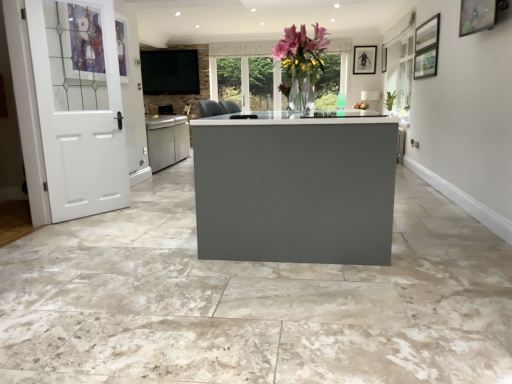
The height and width of the screenshot is (384, 512). What do you see at coordinates (170, 72) in the screenshot?
I see `matte black tv at upper center` at bounding box center [170, 72].

Identify the location of white painted wood door at left. (78, 106).

Is matte black tv at upper center aimed at wooden picture frame at upper right, arranged as the 2th picture frame when viewed from the right?

No, matte black tv at upper center is not facing towards wooden picture frame at upper right, arranged as the 2th picture frame when viewed from the right.

Which is less distant, (169, 57) or (459, 26)?

The point (459, 26) is closer to the camera.

Is matte black tv at upper center surrounding wooden picture frame at upper right, the first picture frame from the front?

That's incorrect, wooden picture frame at upper right, the first picture frame from the front, is not inside matte black tv at upper center.

Looking at the image, does matte black tv at upper center seem bigger or smaller compared to wooden picture frame at upper right, acting as the 2th picture frame starting from the top?

Considering their sizes, matte black tv at upper center takes up more space than wooden picture frame at upper right, acting as the 2th picture frame starting from the top.

Between point (91, 1) and point (486, 19), which one is positioned in front?

The point (486, 19) is closer.

Could you tell me if white painted wood door at left is facing wooden picture frame at upper right, acting as the 2th picture frame starting from the top?

No, white painted wood door at left is not aimed at wooden picture frame at upper right, acting as the 2th picture frame starting from the top.

How much distance is there between white painted wood door at left and wooden picture frame at upper right, which is the first picture frame from bottom to top?

white painted wood door at left and wooden picture frame at upper right, which is the first picture frame from bottom to top, are 3.41 meters apart from each other.

Is white painted wood door at left not within matte black picture frame at upper right, which is counted as the second picture frame, starting from the front?

Yes, white painted wood door at left is not within matte black picture frame at upper right, which is counted as the second picture frame, starting from the front.

Is white painted wood door at left positioned with its back to matte black picture frame at upper right, placed as the 1th picture frame when sorted from back to front?

No, white painted wood door at left is not facing the opposite direction of matte black picture frame at upper right, placed as the 1th picture frame when sorted from back to front.

Is white painted wood door at left taller than matte black picture frame at upper right, arranged as the first picture frame when viewed from the top?

Yes, white painted wood door at left is taller than matte black picture frame at upper right, arranged as the first picture frame when viewed from the top.

Is white painted wood door at left placed right next to matte black picture frame at upper right, which is the second picture frame in bottom-to-top order?

No, white painted wood door at left is not beside matte black picture frame at upper right, which is the second picture frame in bottom-to-top order.

Is wooden picture frame at upper right, acting as the 2th picture frame starting from the top, facing towards white painted wood door at left?

Yes.

How distant is wooden picture frame at upper right, arranged as the 2th picture frame when viewed from the right, from white painted wood door at left?

They are 3.41 meters apart.

Does wooden picture frame at upper right, the first picture frame from the front, appear on the right side of white painted wood door at left?

Yes, wooden picture frame at upper right, the first picture frame from the front, is to the right of white painted wood door at left.

From the white painted wood door at left, count 1st picture frame to the right and point to it. Please provide its 2D coordinates.

[(477, 16)]

Does wooden picture frame at upper right, which is the first picture frame from bottom to top, have a smaller size compared to matte black tv at upper center?

Indeed, wooden picture frame at upper right, which is the first picture frame from bottom to top, has a smaller size compared to matte black tv at upper center.

Is wooden picture frame at upper right, placed as the 2th picture frame when sorted from back to front, closer to the viewer compared to matte black tv at upper center?

That is True.

In the scene shown: Is matte black tv at upper center at the back of wooden picture frame at upper right, which appears as the first picture frame when viewed from the left?

That's not correct — wooden picture frame at upper right, which appears as the first picture frame when viewed from the left, is not looking away from matte black tv at upper center.

Is point (483, 25) closer to camera compared to point (170, 58)?

Yes.

Are matte black picture frame at upper right, which is the second picture frame in bottom-to-top order, and wooden picture frame at upper right, the first picture frame from the front, located far from each other?

Yes, matte black picture frame at upper right, which is the second picture frame in bottom-to-top order, is far from wooden picture frame at upper right, the first picture frame from the front.

What's the angular difference between matte black picture frame at upper right, arranged as the first picture frame when viewed from the top, and wooden picture frame at upper right, acting as the 2th picture frame starting from the top,'s facing directions?

91.6 degrees separate the facing orientations of matte black picture frame at upper right, arranged as the first picture frame when viewed from the top, and wooden picture frame at upper right, acting as the 2th picture frame starting from the top.

From the image's perspective, is matte black picture frame at upper right, which is the second picture frame in bottom-to-top order, located above or below wooden picture frame at upper right, arranged as the 2th picture frame when viewed from the right?

Based on their image positions, matte black picture frame at upper right, which is the second picture frame in bottom-to-top order, is located above wooden picture frame at upper right, arranged as the 2th picture frame when viewed from the right.

Which is correct: matte black picture frame at upper right, the second picture frame in the left-to-right sequence, is inside wooden picture frame at upper right, arranged as the 2th picture frame when viewed from the right, or outside of it?

matte black picture frame at upper right, the second picture frame in the left-to-right sequence, is not enclosed by wooden picture frame at upper right, arranged as the 2th picture frame when viewed from the right.

Is matte black tv at upper center far from white painted wood door at left?

Yes.

Find the location of a particular element. The image size is (512, 384). door below the matte black tv at upper center (from a real-world perspective) is located at coordinates (78, 106).

Is matte black tv at upper center in front of or behind white painted wood door at left in the image?

Clearly, matte black tv at upper center is behind white painted wood door at left.

Is matte black tv at upper center wider than white painted wood door at left?

Yes.

At what (x,y) coordinates should I click in order to perform the action: click on window screen on the left side of wooden picture frame at upper right, acting as the 2th picture frame starting from the top. Please return your answer as a coordinate pair (x, y). The image size is (512, 384). Looking at the image, I should click on [x=170, y=72].

Where is `picture frame that is in front of the white painted wood door at left`? This screenshot has width=512, height=384. picture frame that is in front of the white painted wood door at left is located at coordinates (477, 16).

Looking at the image, which one is located further to wooden picture frame at upper right, which is the first picture frame from bottom to top, matte black tv at upper center or matte black picture frame at upper right, arranged as the first picture frame when viewed from the right?

matte black tv at upper center is positioned further to the anchor wooden picture frame at upper right, which is the first picture frame from bottom to top.

Estimate the real-world distances between objects in this image. Which object is closer to white painted wood door at left, matte black picture frame at upper right, which is the second picture frame in bottom-to-top order, or matte black tv at upper center?

The object closer to white painted wood door at left is matte black tv at upper center.

From the image, which object appears to be farther from white painted wood door at left, matte black picture frame at upper right, which is counted as the second picture frame, starting from the front, or wooden picture frame at upper right, which appears as the first picture frame when viewed from the left?

The object further to white painted wood door at left is matte black picture frame at upper right, which is counted as the second picture frame, starting from the front.

Considering their positions, is matte black picture frame at upper right, which is the second picture frame in bottom-to-top order, positioned further to matte black tv at upper center than wooden picture frame at upper right, which appears as the first picture frame when viewed from the left?

wooden picture frame at upper right, which appears as the first picture frame when viewed from the left, is further to matte black tv at upper center.

Considering their positions, is matte black tv at upper center positioned further to white painted wood door at left than wooden picture frame at upper right, acting as the 2th picture frame starting from the top?

wooden picture frame at upper right, acting as the 2th picture frame starting from the top, is positioned further to the anchor white painted wood door at left.

When comparing their distances from white painted wood door at left, does wooden picture frame at upper right, acting as the 2th picture frame starting from the top, or matte black picture frame at upper right, which is counted as the second picture frame, starting from the front, seem further?

matte black picture frame at upper right, which is counted as the second picture frame, starting from the front, lies further to white painted wood door at left than the other object.

When comparing their distances from matte black picture frame at upper right, which is the second picture frame in bottom-to-top order, does wooden picture frame at upper right, acting as the 2th picture frame starting from the top, or matte black tv at upper center seem further?

wooden picture frame at upper right, acting as the 2th picture frame starting from the top, lies further to matte black picture frame at upper right, which is the second picture frame in bottom-to-top order, than the other object.

Considering their positions, is white painted wood door at left positioned further to wooden picture frame at upper right, arranged as the 2th picture frame when viewed from the right, than matte black picture frame at upper right, the second picture frame in the left-to-right sequence?

white painted wood door at left.

Identify the location of picture frame positioned between wooden picture frame at upper right, the first picture frame from the front, and matte black tv at upper center from near to far. This screenshot has height=384, width=512. (364, 59).

I want to click on door between wooden picture frame at upper right, which appears as the first picture frame when viewed from the left, and matte black picture frame at upper right, which is the second picture frame in bottom-to-top order, from front to back, so click(x=78, y=106).

Image resolution: width=512 pixels, height=384 pixels. I want to click on door between wooden picture frame at upper right, which appears as the first picture frame when viewed from the left, and matte black tv at upper center from front to back, so click(78, 106).

This screenshot has height=384, width=512. I want to click on picture frame between white painted wood door at left and matte black tv at upper center from front to back, so click(364, 59).